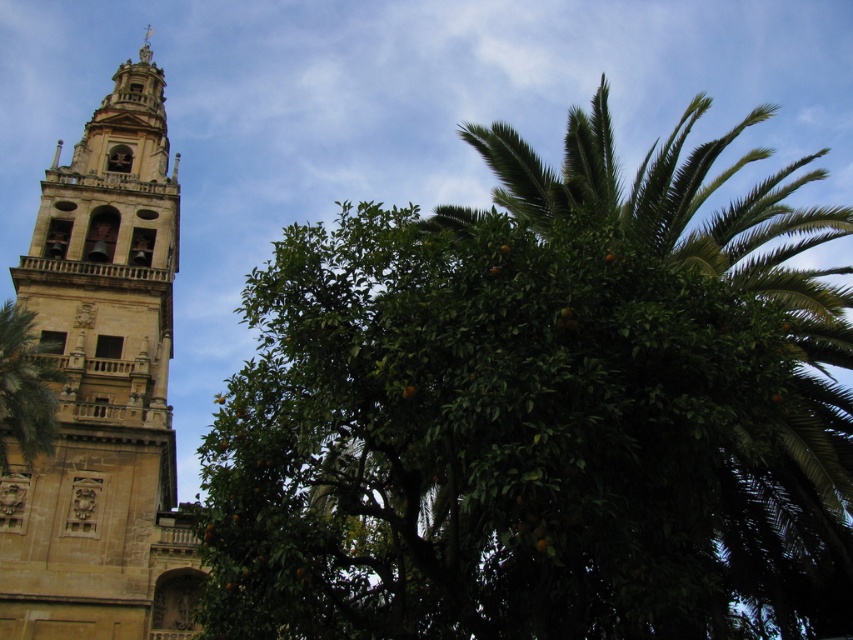
You are an architect analyzing the spatial relationship between the green leafy orange tree at center and the beige stone tower at left. Based on the scene, which object is closer to the viewer?

The green leafy orange tree at center is closer to the viewer because it is positioned in front of the beige stone tower at left.